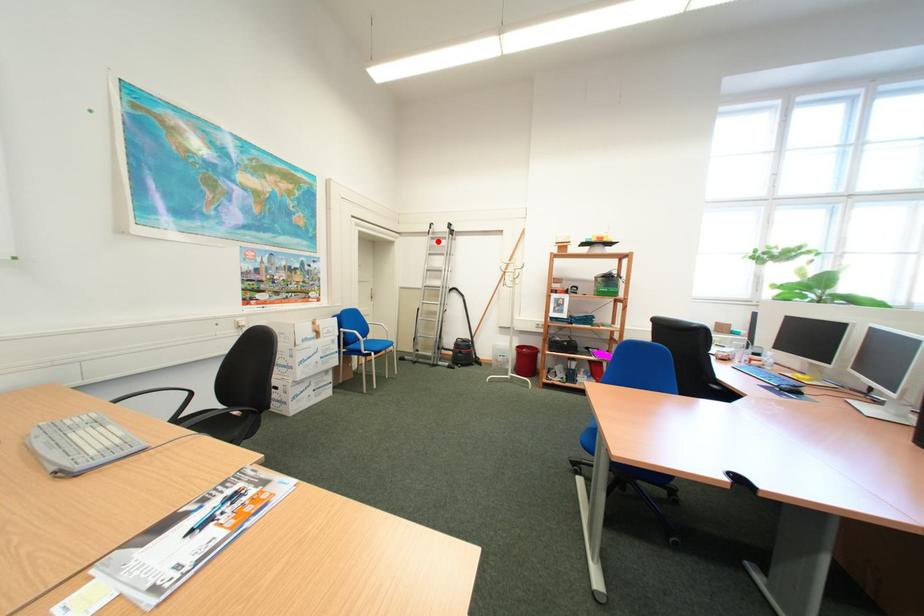
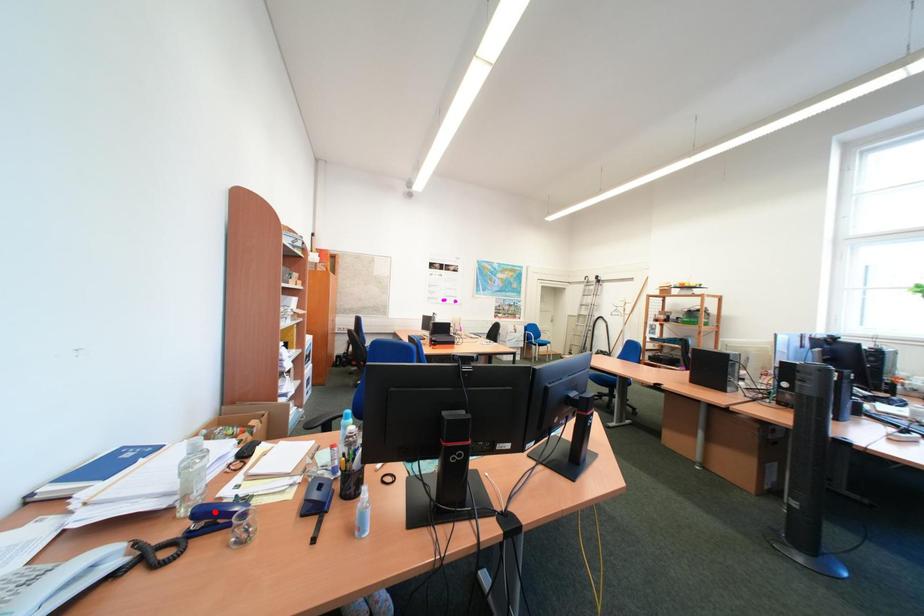
Consider the image. I am providing you with two images of the same scene from different viewpoints. A red point is marked on the first image and another point is marked on the second image. Are the points marked in image1 and image2 representing the same 3D position?

No